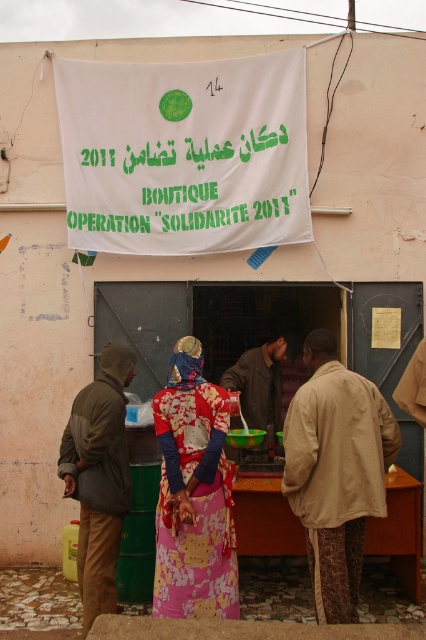
You are a customer in the store and want to place a large box on the counter between the printed fabric dress at center and the dark green hooded jacket at left. Can you fit the box there if the box requires 1.2 meters of space?

The printed fabric dress at center might be wider than dark green hooded jacket at left, so the space between them may not be sufficient for a box requiring 1.2 meters of space. Check the exact distance before placing the box.

You are a customer browsing jackets in the store. You see a beige fabric jacket at center and a dark brown leather jacket at center. Which jacket is positioned to the right of the other?

The beige fabric jacket at center is to the right of the dark brown leather jacket at center.